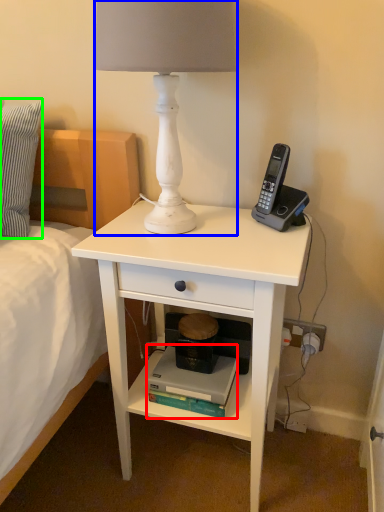
Question: Considering the real-world distances, which object is farthest from book (highlighted by a red box)? lamp (highlighted by a blue box) or pillow (highlighted by a green box)?

Choices:
 (A) lamp
 (B) pillow

Answer: (B)